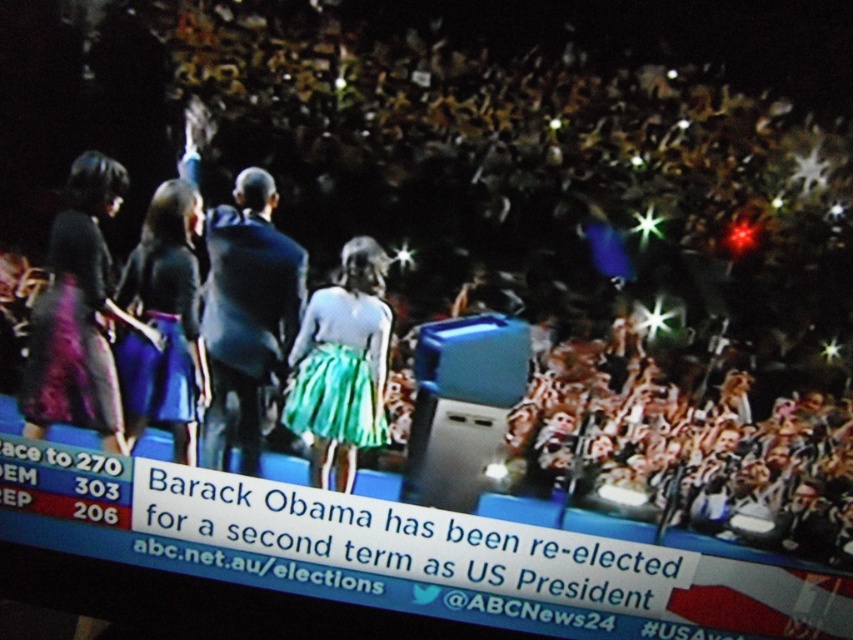
You are a photographer in the audience at this event. You need to capture a closeup of both the dark blue suit at center and the teal satin skirt at center. Since you can only focus on one subject at a time, which one should you choose to ensure the other remains in the background but still recognizable?

You should focus on the dark blue suit at center because it is bigger than the teal satin skirt at center. By focusing on the larger subject, the smaller one will naturally stay in the background and still be recognizable.

You are a photographer positioned at the back of the hall. You need to capture a clear photo of both the dark blue suit at center and the matte black dress at left. Which person should you focus on first to ensure both are in the frame?

You should focus on the dark blue suit at center first since it is in front of the matte black dress at left, ensuring both are visible in the frame by starting with the closer subject.

You are a photographer positioned at the back of the hall. You want to take a photo of both point (316, 436) and point (144, 300) in the scene. Will both points be in focus if you focus on the closer one?

Point (316, 436) is further to the camera than point (144, 300). If you focus on the closer point (144, 300), the further point (316, 436) may not be in focus depending on the depth of field. To ensure both are in focus, adjust focus or use a smaller aperture.